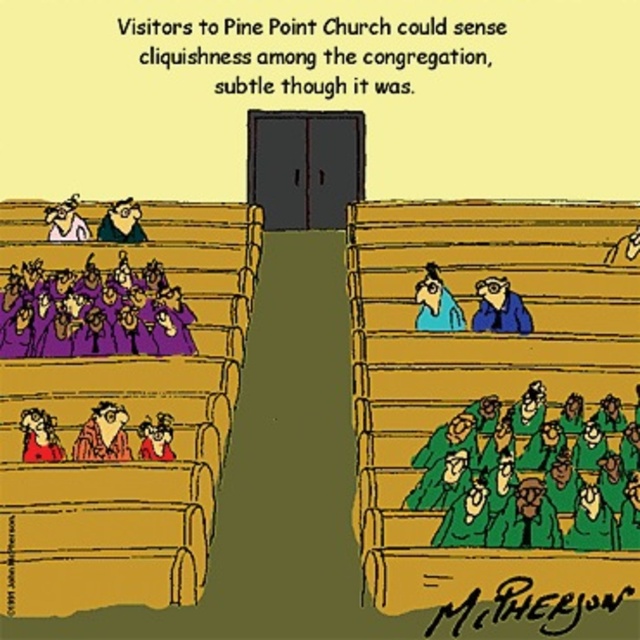
Question: Which point is closer to the camera taking this photo?

Choices:
 (A) 512,324
 (B) 484,512
 (C) 35,456
 (D) 122,442

Answer: (B)

Question: Observing the image, what is the correct spatial positioning of wooden pews at left in reference to green fabric person at lower center?

Choices:
 (A) left
 (B) right

Answer: (A)

Question: Which object appears closest to the camera in this image?

Choices:
 (A) reddish-brown hair at lower left
 (B) purple matte choir robes at center
 (C) blue fabric glasses at upper right

Answer: (A)

Question: Does wooden pews at left appear over purple matte choir robes at center?

Choices:
 (A) no
 (B) yes

Answer: (A)

Question: Is wooden pews at left smaller than matte black person at upper left?

Choices:
 (A) yes
 (B) no

Answer: (B)

Question: Which is nearer to the matte black suit at upper left?

Choices:
 (A) reddish-brown hair at lower left
 (B) green matte robes at lower right

Answer: (A)